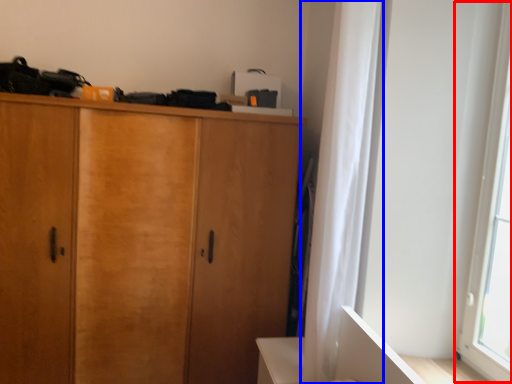
Question: Which object appears farthest to the camera in this image, window screen (highlighted by a red box) or curtain (highlighted by a blue box)?

Choices:
 (A) window screen
 (B) curtain

Answer: (B)